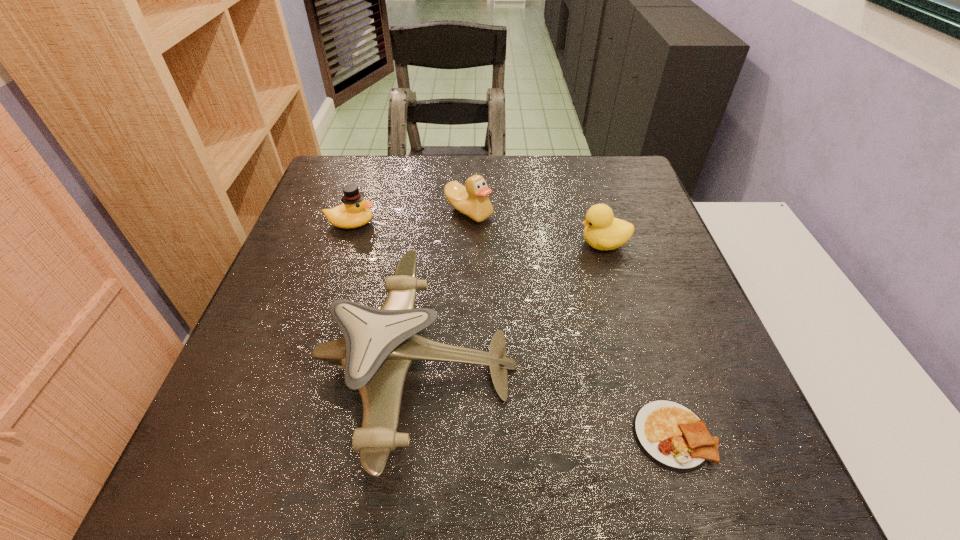
Locate an element on the screen. Image resolution: width=960 pixels, height=540 pixels. object that is at the near right corner is located at coordinates (671, 435).

In the image, there is a desktop. Identify the location of free space at the far edge. The image size is (960, 540). (453, 155).

In the image, there is a desktop. Where is `free space at the near edge`? The height and width of the screenshot is (540, 960). free space at the near edge is located at coordinates (577, 495).

At what (x,y) coordinates should I click in order to perform the action: click on free region at the left edge of the desktop. Please return your answer as a coordinate pair (x, y). The width and height of the screenshot is (960, 540). Looking at the image, I should click on (251, 400).

In order to click on free space at the right edge of the desktop in this screenshot , I will do `click(689, 393)`.

Where is `blank space at the far left corner of the desktop`? blank space at the far left corner of the desktop is located at coordinates (385, 157).

Identify the location of free space at the near left corner. (235, 476).

At what (x,y) coordinates should I click in order to perform the action: click on vacant space at the far right corner. Please return your answer as a coordinate pair (x, y). Looking at the image, I should click on (591, 160).

The height and width of the screenshot is (540, 960). I want to click on vacant space at the near right corner, so coord(760,465).

This screenshot has height=540, width=960. In order to click on vacant area between the leftmost duck and the drone in this screenshot , I will do `click(384, 294)`.